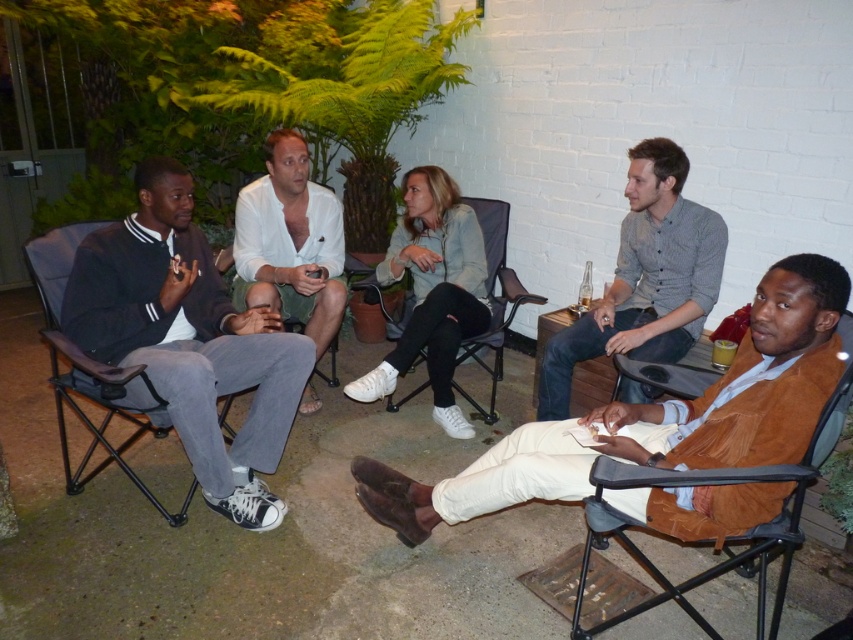
Does brown suede jacket at lower right have a greater height compared to black fabric chair at center?

No, brown suede jacket at lower right is not taller than black fabric chair at center.

Who is shorter, brown suede jacket at lower right or black fabric chair at center?

brown suede jacket at lower right

This screenshot has height=640, width=853. What do you see at coordinates (654, 417) in the screenshot?
I see `brown suede jacket at lower right` at bounding box center [654, 417].

Where is `brown suede jacket at lower right`? brown suede jacket at lower right is located at coordinates (654, 417).

Does suede-like brown chair at lower right have a lesser width compared to black fabric chair at center?

Incorrect, suede-like brown chair at lower right's width is not less than black fabric chair at center's.

Does suede-like brown chair at lower right have a smaller size compared to black fabric chair at center?

Yes, suede-like brown chair at lower right is smaller than black fabric chair at center.

Image resolution: width=853 pixels, height=640 pixels. In order to click on suede-like brown chair at lower right in this screenshot , I will do `click(718, 541)`.

Consider the image. Does dark gray cotton pants at left appear on the right side of gray button-up shirt at upper right?

Incorrect, dark gray cotton pants at left is not on the right side of gray button-up shirt at upper right.

Which is in front, point (178, 294) or point (643, 243)?

Point (178, 294) is in front.

Between point (192, 308) and point (641, 392), which one is positioned in front?

Positioned in front is point (641, 392).

I want to click on dark gray cotton pants at left, so click(x=189, y=340).